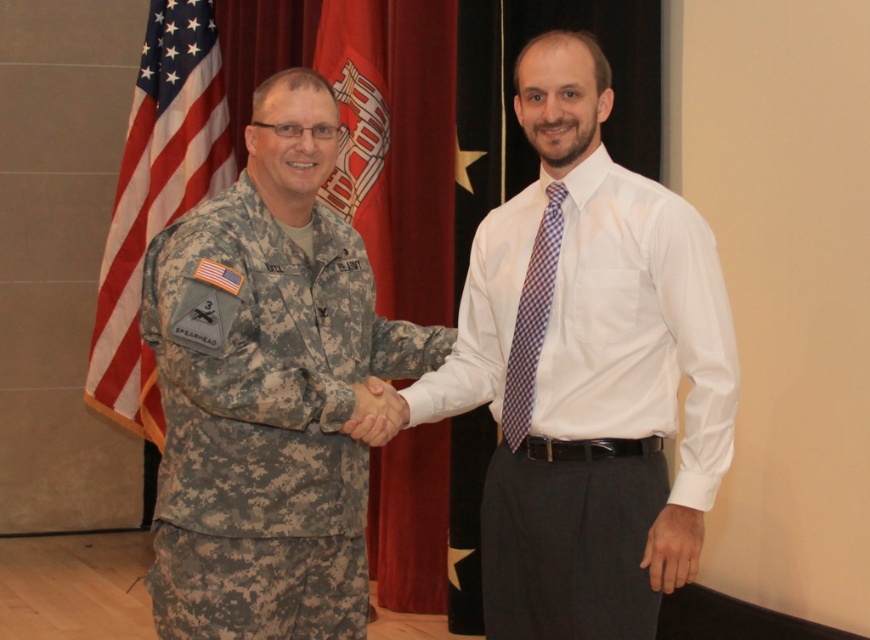
You are a photographer positioned at the center of the scene. You need to adjust your camera to focus on the camouflage fabric uniform at center. Based on its position, will you need to pan your camera to the left or right to center it in your viewfinder?

The camouflage fabric uniform at center is located at point coordinates that are slightly to the right of the exact center. Since the x coordinate is 0.656, which is greater than 0.5, the uniform is positioned to the right of the center. Therefore, to center it in the viewfinder, you would need to pan your camera slightly to the right.

Based on the scene description, can you determine the spatial relationship between the camouflage fabric uniform at center and the american flag at left? Specifically, which object is positioned to the right of the other?

The camouflage fabric uniform at center is to the right of the american flag at left.